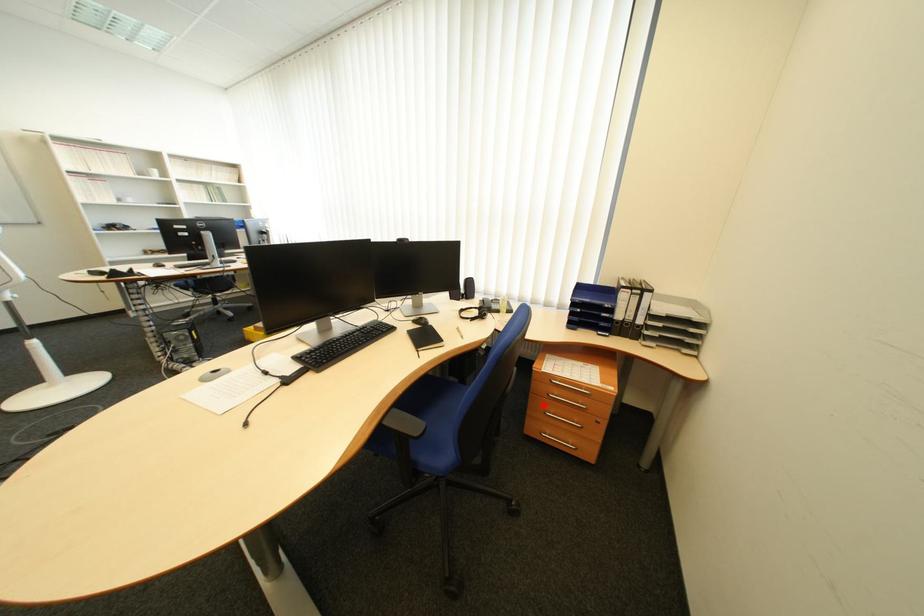
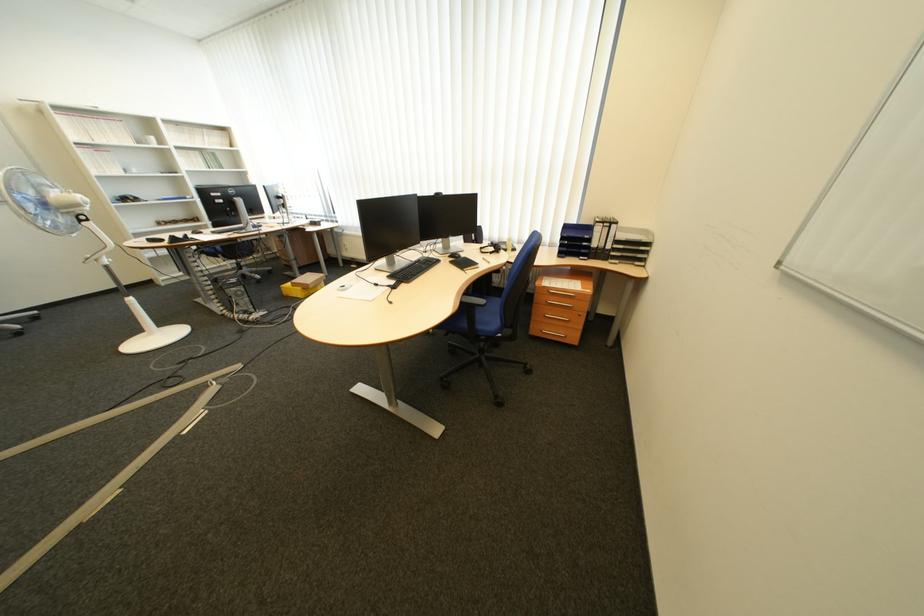
Locate, in the second image, the point that corresponds to the highlighted location in the first image.

(546, 313)